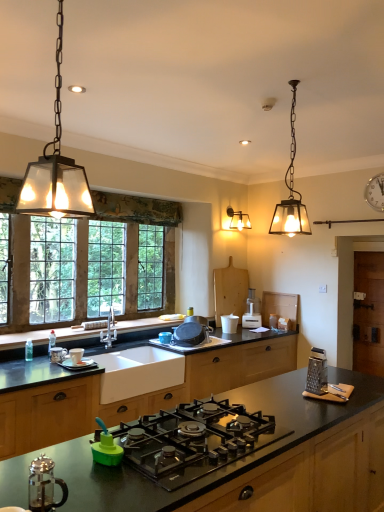
Image resolution: width=384 pixels, height=512 pixels. I want to click on blank area beneath matte glass pendant light at upper right, which appears as the 2th lamp when viewed from the left (from a real-world perspective), so click(x=286, y=398).